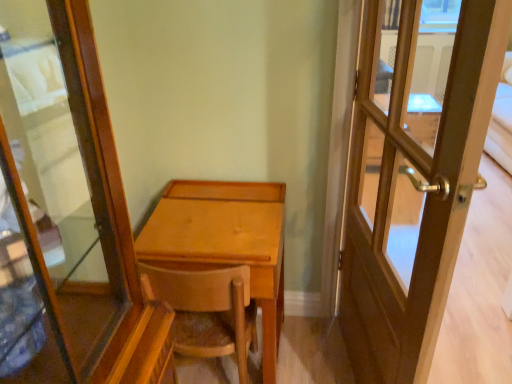
Question: Is light brown wood desk at center shorter than wooden chair at center?

Choices:
 (A) no
 (B) yes

Answer: (A)

Question: Is light brown wood desk at center not inside wooden chair at center?

Choices:
 (A) yes
 (B) no

Answer: (B)

Question: Can you confirm if light brown wood desk at center is wider than wooden chair at center?

Choices:
 (A) yes
 (B) no

Answer: (A)

Question: Is the depth of light brown wood desk at center less than that of wooden chair at center?

Choices:
 (A) yes
 (B) no

Answer: (B)

Question: Is wooden chair at center at the back of light brown wood desk at center?

Choices:
 (A) yes
 (B) no

Answer: (A)

Question: Can you confirm if light brown wood desk at center is positioned to the right of wooden chair at center?

Choices:
 (A) yes
 (B) no

Answer: (A)

Question: Considering the relative positions of light brown wood desk at center and wooden door at right in the image provided, is light brown wood desk at center to the right of wooden door at right from the viewer's perspective?

Choices:
 (A) yes
 (B) no

Answer: (B)

Question: Is light brown wood desk at center wider than wooden door at right?

Choices:
 (A) no
 (B) yes

Answer: (B)

Question: Is light brown wood desk at center beside wooden door at right?

Choices:
 (A) no
 (B) yes

Answer: (A)

Question: Can you confirm if light brown wood desk at center is bigger than wooden door at right?

Choices:
 (A) yes
 (B) no

Answer: (A)

Question: From a real-world perspective, is light brown wood desk at center positioned over wooden door at right based on gravity?

Choices:
 (A) yes
 (B) no

Answer: (B)

Question: Is light brown wood desk at center taller than wooden door at right?

Choices:
 (A) no
 (B) yes

Answer: (A)

Question: Is wooden chair at center smaller than light brown wood desk at center?

Choices:
 (A) yes
 (B) no

Answer: (A)